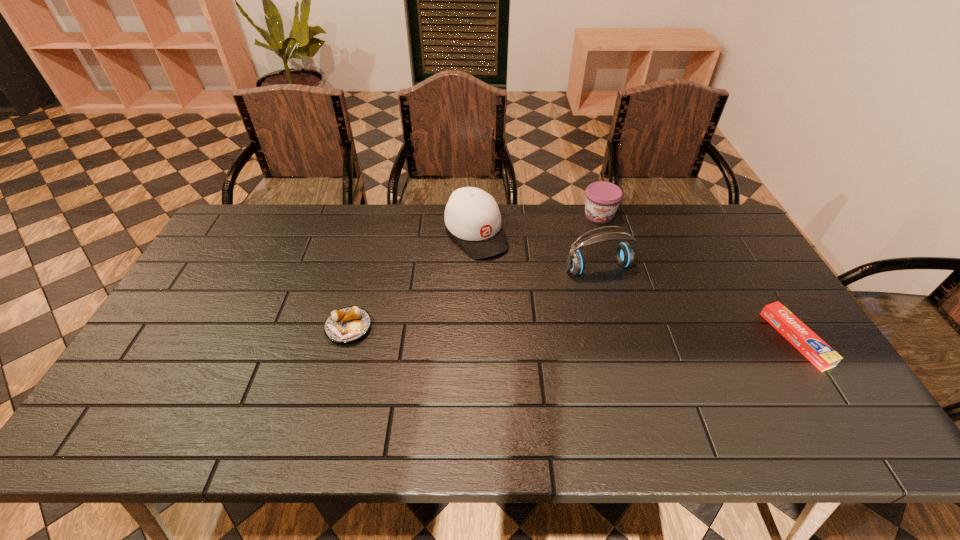
You are a GUI agent. You are given a task and a screenshot of the screen. Output one action in this format:
    pyautogui.click(x=<x>, y=<y>)
    Task: Click on the object that is at the right edge
    Image resolution: width=960 pixels, height=540 pixels.
    Given the screenshot: What is the action you would take?
    pyautogui.click(x=819, y=353)

This screenshot has height=540, width=960. I want to click on vacant space at the far edge, so click(x=543, y=218).

Find the location of a particular element. free region at the near edge of the desktop is located at coordinates (598, 399).

Image resolution: width=960 pixels, height=540 pixels. In the image, there is a desktop. Find the location of `vacant space at the left edge`. vacant space at the left edge is located at coordinates (180, 368).

In the image, there is a desktop. At what (x,y) coordinates should I click in order to perform the action: click on vacant area at the right edge. Please return your answer as a coordinate pair (x, y). This screenshot has width=960, height=540. Looking at the image, I should click on (768, 302).

Locate an element on the screen. vacant space at the far left corner is located at coordinates (261, 219).

The width and height of the screenshot is (960, 540). Identify the location of vacant region at the far right corner. (714, 208).

This screenshot has width=960, height=540. I want to click on free space between the leftmost object and the third shortest object, so click(x=474, y=271).

The height and width of the screenshot is (540, 960). What are the coordinates of `vacant space in between the baseball cap and the headset` in the screenshot? It's located at (538, 251).

This screenshot has width=960, height=540. I want to click on blank region between the baseball cap and the toothpaste, so coord(636,287).